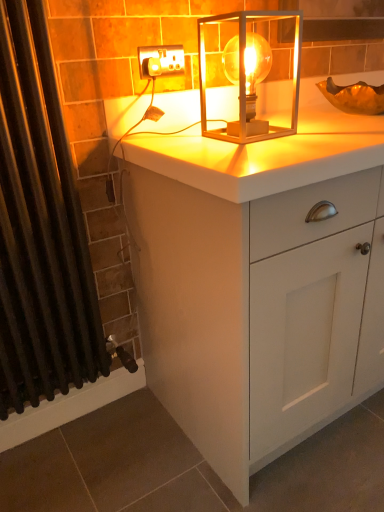
Question: From the image's perspective, is black fabric shower curtain at left positioned above or below white plastic socket at upper center?

Choices:
 (A) below
 (B) above

Answer: (A)

Question: Based on their positions, is black fabric shower curtain at left located to the left or right of white plastic socket at upper center?

Choices:
 (A) left
 (B) right

Answer: (A)

Question: Which object is the farthest from the white plastic socket at upper center?

Choices:
 (A) black fabric shower curtain at left
 (B) white matte cabinet at center
 (C) translucent glass lamp at center

Answer: (B)

Question: Which is nearer to the black fabric shower curtain at left?

Choices:
 (A) white plastic socket at upper center
 (B) translucent glass lamp at center
 (C) white matte cabinet at center

Answer: (C)